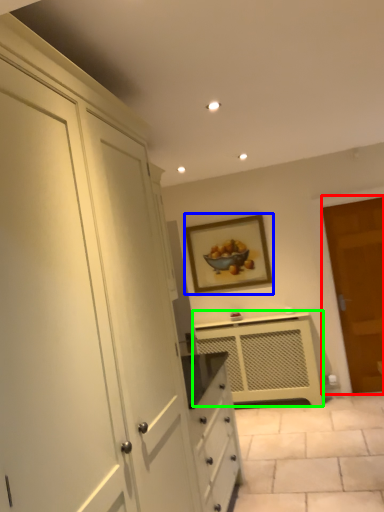
Question: Based on their relative distances, which object is nearer to door (highlighted by a red box)? Choose from picture frame (highlighted by a blue box) and cabinetry (highlighted by a green box).

Choices:
 (A) picture frame
 (B) cabinetry

Answer: (B)